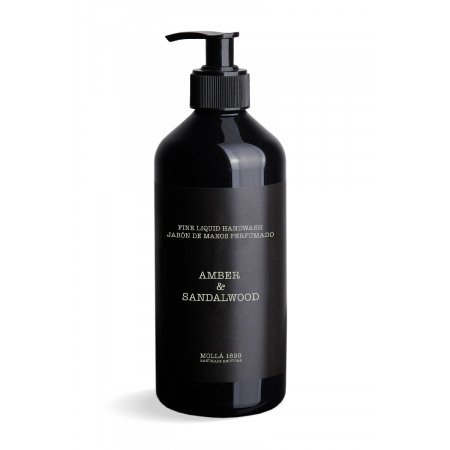
What are the coordinates of `dispenser bottle` in the screenshot? It's located at (245, 328).